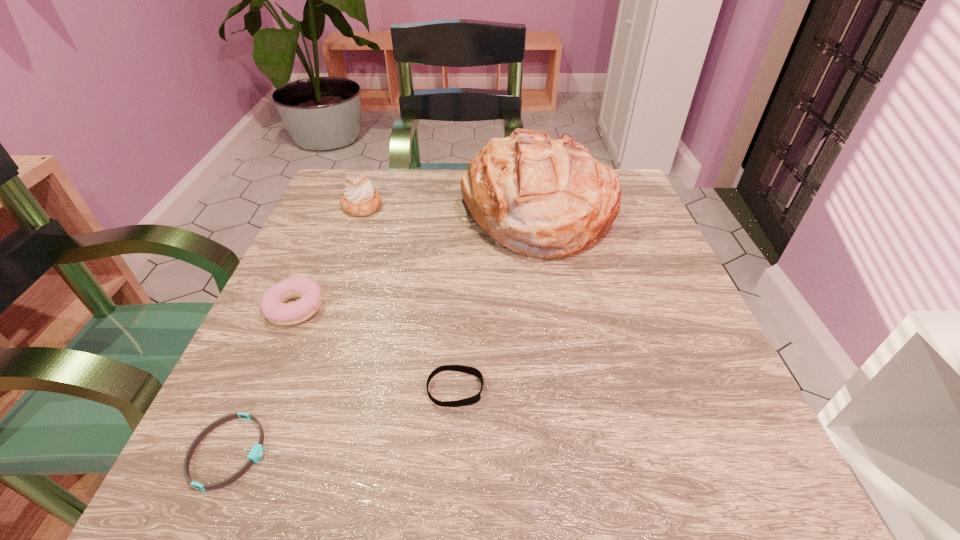
At what (x,y) coordinates should I click in order to perform the action: click on the tallest object. Please return your answer as a coordinate pair (x, y). Looking at the image, I should click on (540, 197).

This screenshot has height=540, width=960. I want to click on the fourth shortest object, so click(360, 199).

At what (x,y) coordinates should I click in order to perform the action: click on the third tallest object. Please return your answer as a coordinate pair (x, y). Looking at the image, I should click on (272, 305).

Locate an element on the screen. This screenshot has width=960, height=540. doughnut is located at coordinates (272, 305).

Locate an element on the screen. The height and width of the screenshot is (540, 960). the right wristband is located at coordinates (459, 368).

Where is `the fourth farthest object`? This screenshot has width=960, height=540. the fourth farthest object is located at coordinates tap(459, 368).

Where is `the nearest object`? The width and height of the screenshot is (960, 540). the nearest object is located at coordinates [255, 454].

The height and width of the screenshot is (540, 960). I want to click on the shortest object, so click(x=255, y=454).

Where is `free space located on the front of the tallest object`? This screenshot has height=540, width=960. free space located on the front of the tallest object is located at coordinates (550, 287).

Find the location of a particular element. This screenshot has height=540, width=960. free space located 0.260m on the front of the pastry is located at coordinates (328, 300).